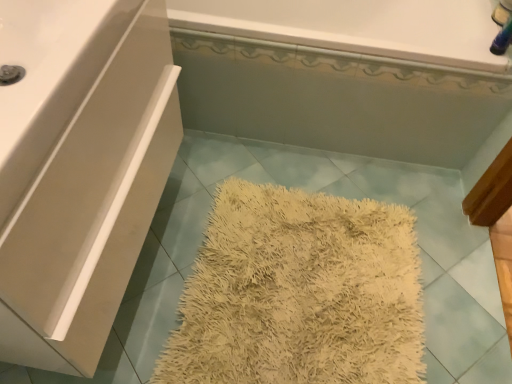
Question: Considering the positions of white glossy bathtub at upper center, the 1th bath in the front-to-back sequence, and white matte cabinet at upper left in the image, is white glossy bathtub at upper center, the 1th bath in the front-to-back sequence, taller or shorter than white matte cabinet at upper left?

Choices:
 (A) tall
 (B) short

Answer: (B)

Question: Considering the relative positions of white glossy bathtub at upper center, the 1th bath in the front-to-back sequence, and white matte cabinet at upper left in the image provided, is white glossy bathtub at upper center, the 1th bath in the front-to-back sequence, to the left or to the right of white matte cabinet at upper left?

Choices:
 (A) left
 (B) right

Answer: (B)

Question: Estimate the real-world distances between objects in this image. Which object is farther from the white glossy bathtub at upper center, the 2th bath positioned from the front?

Choices:
 (A) white glossy bathtub at upper center, which is counted as the second bath, starting from the back
 (B) white glossy counter top at upper left
 (C) white matte cabinet at upper left

Answer: (B)

Question: Which object is positioned farthest from the white glossy bathtub at upper center, the 1th bath in the front-to-back sequence?

Choices:
 (A) white glossy counter top at upper left
 (B) white matte cabinet at upper left
 (C) white glossy bathtub at upper center, marked as the 1th bath in a back-to-front arrangement

Answer: (A)